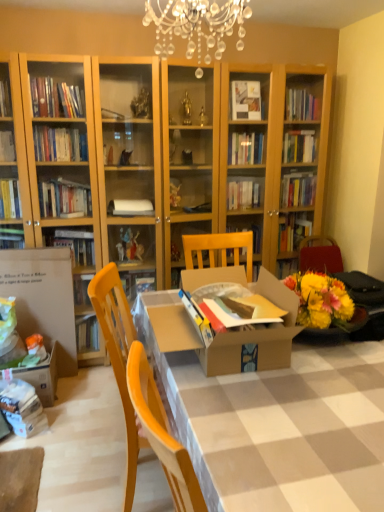
Question: Is wooden chair at center inside white cardboard box at left?

Choices:
 (A) no
 (B) yes

Answer: (A)

Question: Is white cardboard box at left turned away from wooden chair at center?

Choices:
 (A) no
 (B) yes

Answer: (A)

Question: From a real-world perspective, is white cardboard box at left on wooden chair at center?

Choices:
 (A) yes
 (B) no

Answer: (B)

Question: From the image's perspective, would you say white cardboard box at left is positioned over wooden chair at center?

Choices:
 (A) yes
 (B) no

Answer: (A)

Question: Does white cardboard box at left lie in front of wooden chair at center?

Choices:
 (A) yes
 (B) no

Answer: (B)

Question: Considering the relative sizes of white cardboard box at left and wooden chair at center in the image provided, is white cardboard box at left smaller than wooden chair at center?

Choices:
 (A) no
 (B) yes

Answer: (B)

Question: From a real-world perspective, is cardboard box at center beneath white cardboard box at left?

Choices:
 (A) no
 (B) yes

Answer: (B)

Question: Is cardboard box at center oriented away from white cardboard box at left?

Choices:
 (A) no
 (B) yes

Answer: (A)

Question: Does cardboard box at center contain white cardboard box at left?

Choices:
 (A) yes
 (B) no

Answer: (B)

Question: From the image's perspective, would you say cardboard box at center is shown under white cardboard box at left?

Choices:
 (A) no
 (B) yes

Answer: (B)

Question: From a real-world perspective, is cardboard box at center positioned over white cardboard box at left based on gravity?

Choices:
 (A) yes
 (B) no

Answer: (B)

Question: Is cardboard box at center shorter than white cardboard box at left?

Choices:
 (A) yes
 (B) no

Answer: (A)

Question: From the image's perspective, is wooden chair at center below white cardboard box at left?

Choices:
 (A) no
 (B) yes

Answer: (B)